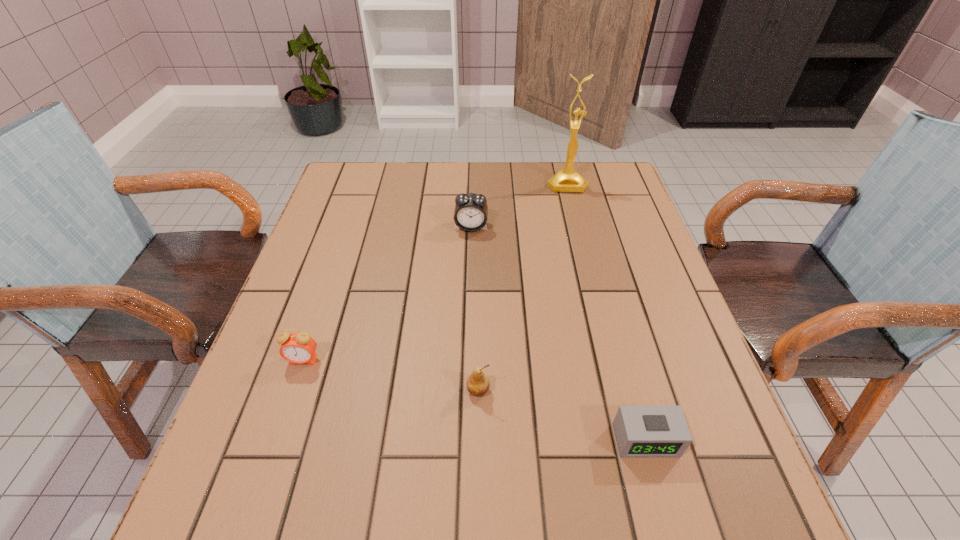
Find the location of a particular element. the farthest object is located at coordinates (565, 180).

I want to click on the tallest object, so click(x=565, y=180).

What are the coordinates of `the farthest alarm clock` in the screenshot? It's located at (471, 211).

Where is `the fourth nearest object`? This screenshot has height=540, width=960. the fourth nearest object is located at coordinates (471, 211).

Locate an element on the screen. The height and width of the screenshot is (540, 960). the leftmost alarm clock is located at coordinates (299, 348).

This screenshot has width=960, height=540. Identify the location of the leftmost object. (299, 348).

Where is `pear`? pear is located at coordinates (478, 384).

Where is `the shortest object`? the shortest object is located at coordinates (642, 431).

This screenshot has height=540, width=960. Identify the location of the nearest alarm clock. (642, 431).

The width and height of the screenshot is (960, 540). I want to click on free space located on the front-facing side of the farthest object, so click(573, 210).